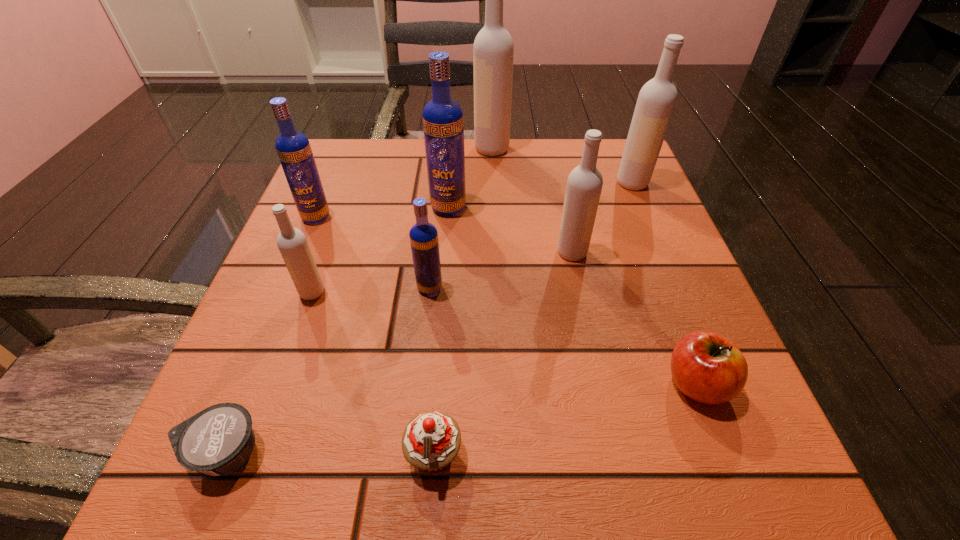
Locate an element on the screen. the third white vodka from right to left is located at coordinates (493, 51).

The height and width of the screenshot is (540, 960). What are the coordinates of `the tallest object` in the screenshot? It's located at (493, 51).

Locate an element on the screen. The height and width of the screenshot is (540, 960). the rightmost white vodka is located at coordinates (657, 98).

You are a GUI agent. You are given a task and a screenshot of the screen. Output one action in this format:
    pyautogui.click(x=<x>, y=<y>)
    Task: Click on the ninth nearest object
    
    Given the screenshot: What is the action you would take?
    pyautogui.click(x=657, y=98)

At what (x,y) coordinates should I click in order to perform the action: click on the biggest blue vodka. Please return your answer as a coordinate pair (x, y). Looking at the image, I should click on (443, 124).

The width and height of the screenshot is (960, 540). I want to click on the leftmost blue vodka, so click(x=293, y=148).

Locate an element on the screen. the eighth object from left to right is located at coordinates (584, 185).

At what (x,y) coordinates should I click in order to perform the action: click on the second nearest white vodka. Please return your answer as a coordinate pair (x, y). Looking at the image, I should click on (584, 185).

At what (x,y) coordinates should I click in order to perform the action: click on the smallest blue vodka. Please return your answer as a coordinate pair (x, y). Looking at the image, I should click on click(x=423, y=235).

Identify the location of the nearest white vodka. tap(292, 243).